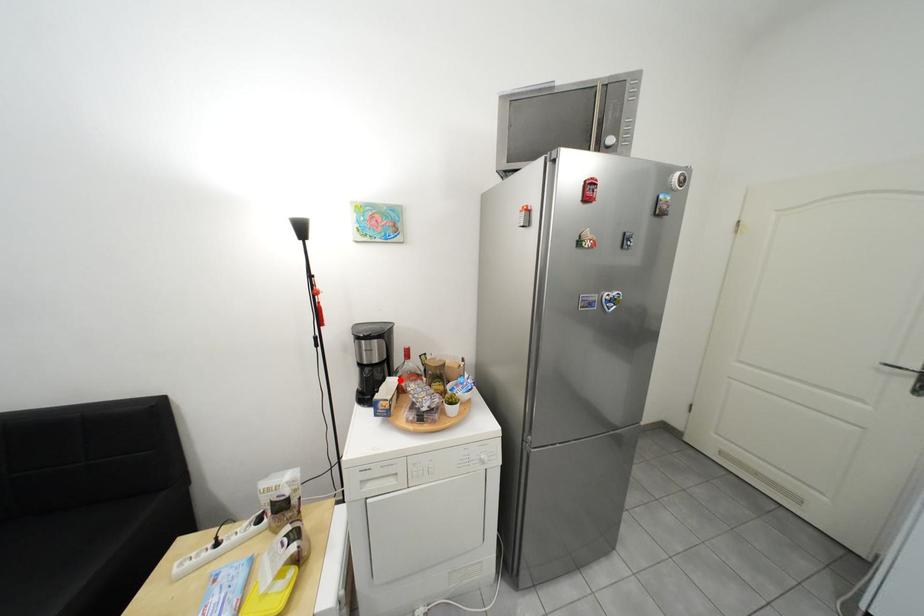
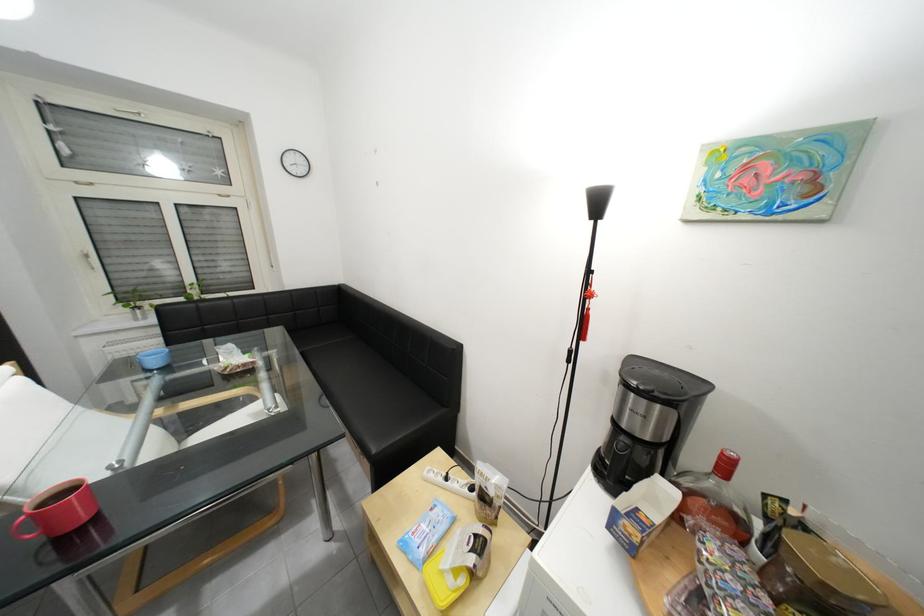
Locate, in the second image, the point that corresponds to the highlighted location in the first image.

(671, 480)